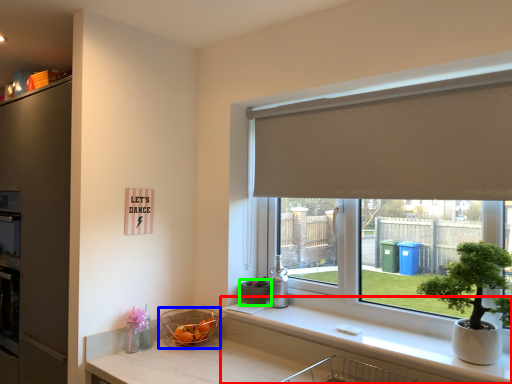
Question: Which object is the farthest from counter top (highlighted by a red box)? Choose among these: basket (highlighted by a blue box) or flowerpot (highlighted by a green box).

Choices:
 (A) basket
 (B) flowerpot

Answer: (A)